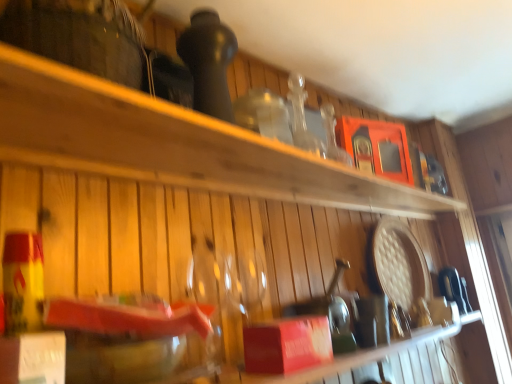
At what (x,y) coordinates should I click in order to perform the action: click on wooden shelf at upper center. Please return your answer as a coordinate pair (x, y). The width and height of the screenshot is (512, 384). Looking at the image, I should click on (173, 144).

What do you see at coordinates (173, 144) in the screenshot? I see `wooden shelf at upper center` at bounding box center [173, 144].

What is the approximate height of wooden shelf at upper center?

wooden shelf at upper center is 1.56 inches tall.

You are a GUI agent. You are given a task and a screenshot of the screen. Output one action in this format:
    pyautogui.click(x=<x>, y=<y>)
    Task: Click on the wooden shelf at upper center
    The height and width of the screenshot is (384, 512).
    Given the screenshot: What is the action you would take?
    pyautogui.click(x=173, y=144)